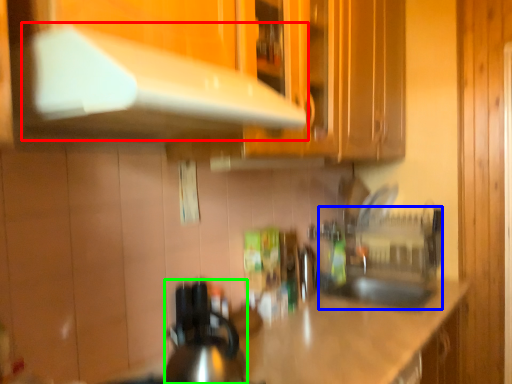
Question: Considering the real-world distances, which object is closest to exhaust hood (highlighted by a red box)? sink (highlighted by a blue box) or kitchen appliance (highlighted by a green box).

Choices:
 (A) sink
 (B) kitchen appliance

Answer: (B)